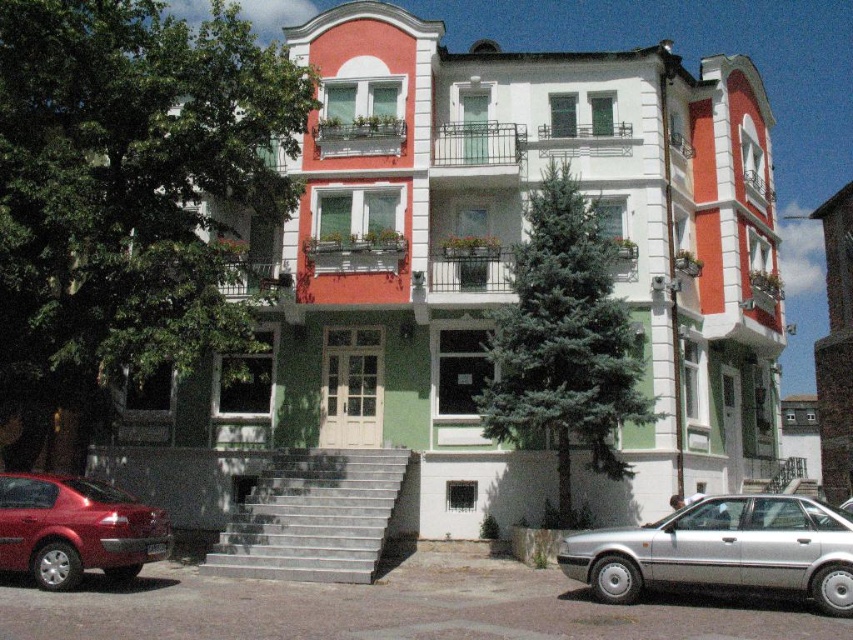
Does silver metallic sedan at lower right have a lesser width compared to gray concrete stairs at center?

No, silver metallic sedan at lower right is not thinner than gray concrete stairs at center.

Does silver metallic sedan at lower right appear on the right side of gray concrete stairs at center?

Yes, silver metallic sedan at lower right is to the right of gray concrete stairs at center.

Between point (685, 529) and point (335, 547), which one is positioned behind?

The point (335, 547) is behind.

At what (x,y) coordinates should I click in order to perform the action: click on silver metallic sedan at lower right. Please return your answer as a coordinate pair (x, y). This screenshot has width=853, height=640. Looking at the image, I should click on (723, 550).

Can you confirm if gray concrete stairs at center is positioned to the right of shiny red sedan at lower left?

Indeed, gray concrete stairs at center is positioned on the right side of shiny red sedan at lower left.

Locate an element on the screen. gray concrete stairs at center is located at coordinates (312, 516).

Is point (787, 500) closer to camera compared to point (20, 548)?

Yes, point (787, 500) is closer to viewer.

Is point (793, 545) more distant than point (36, 563)?

That is False.

The height and width of the screenshot is (640, 853). What are the coordinates of `silver metallic sedan at lower right` in the screenshot? It's located at (723, 550).